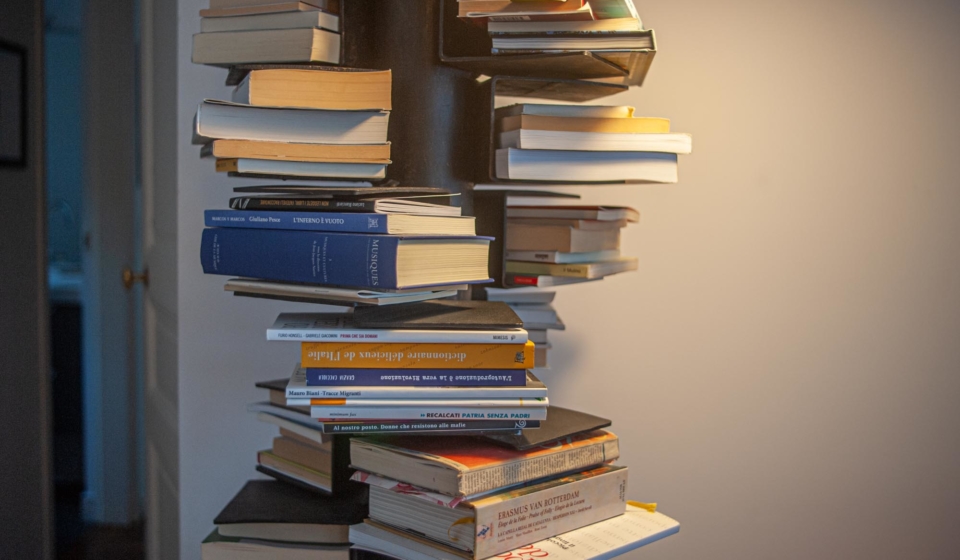
Where is `shelf`? The image size is (960, 560). shelf is located at coordinates (516, 58), (360, 63), (312, 294), (513, 280), (498, 175), (504, 192), (351, 189), (324, 491), (523, 441), (491, 322).